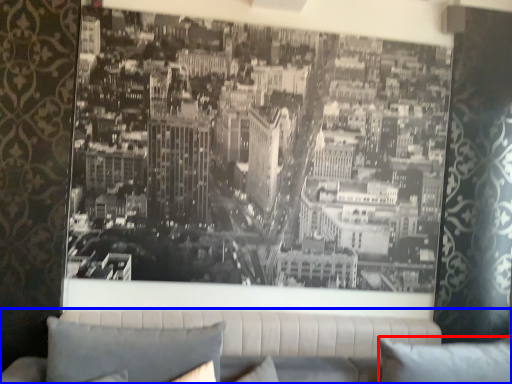
Question: Which of the following is the farthest to the observer, pillow (highlighted by a red box) or studio couch (highlighted by a blue box)?

Choices:
 (A) pillow
 (B) studio couch

Answer: (B)